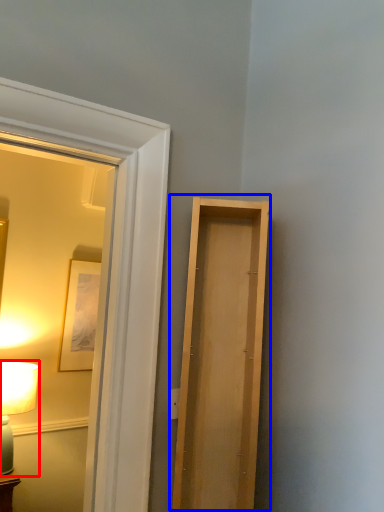
Question: Which of the following is the farthest to the observer, table lamp (highlighted by a red box) or door (highlighted by a blue box)?

Choices:
 (A) table lamp
 (B) door

Answer: (A)